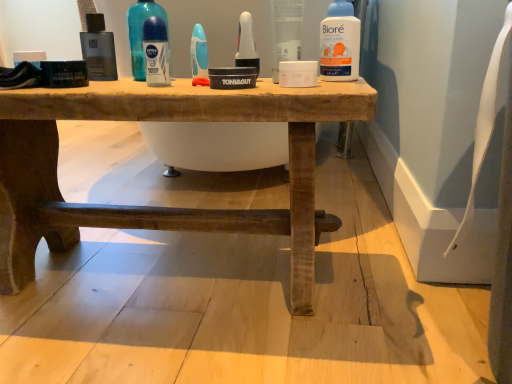
Question: Considering the relative positions of rustic wood table at center and white plastic biore at upper center, the second cleaning product positioned from the left, in the image provided, is rustic wood table at center to the left of white plastic biore at upper center, the second cleaning product positioned from the left, from the viewer's perspective?

Choices:
 (A) yes
 (B) no

Answer: (A)

Question: Does rustic wood table at center lie behind white plastic biore at upper center, acting as the 1th cleaning product starting from the right?

Choices:
 (A) no
 (B) yes

Answer: (A)

Question: From a real-world perspective, is rustic wood table at center beneath white plastic biore at upper center, the second cleaning product positioned from the left?

Choices:
 (A) yes
 (B) no

Answer: (A)

Question: Can you confirm if rustic wood table at center is taller than white plastic biore at upper center, the second cleaning product positioned from the left?

Choices:
 (A) no
 (B) yes

Answer: (B)

Question: Does rustic wood table at center have a greater width compared to white plastic biore at upper center, the 2th cleaning product viewed from the back?

Choices:
 (A) yes
 (B) no

Answer: (A)

Question: From the image's perspective, is rustic wood table at center positioned above or below white matte jar at center?

Choices:
 (A) below
 (B) above

Answer: (A)

Question: In the image, is rustic wood table at center on the left side or the right side of white matte jar at center?

Choices:
 (A) right
 (B) left

Answer: (B)

Question: Choose the correct answer: Is rustic wood table at center inside white matte jar at center or outside it?

Choices:
 (A) inside
 (B) outside

Answer: (B)

Question: Does point (6, 284) appear closer or farther from the camera than point (298, 18)?

Choices:
 (A) farther
 (B) closer

Answer: (A)

Question: Considering the positions of transparent plastic deodorant at center, the 2th mouthwash viewed from the left, and white matte jar at center in the image, is transparent plastic deodorant at center, the 2th mouthwash viewed from the left, taller or shorter than white matte jar at center?

Choices:
 (A) tall
 (B) short

Answer: (B)

Question: From the image's perspective, is transparent plastic deodorant at center, the 3th mouthwash positioned from the right, positioned above or below white matte jar at center?

Choices:
 (A) above
 (B) below

Answer: (B)

Question: From a real-world perspective, is transparent plastic deodorant at center, the 2th mouthwash viewed from the left, physically located above or below white matte jar at center?

Choices:
 (A) below
 (B) above

Answer: (A)

Question: Looking at their shapes, would you say transparent plastic deodorant at center, the 3th mouthwash positioned from the right, is wider or thinner than white matte jar at center?

Choices:
 (A) wide
 (B) thin

Answer: (B)

Question: Is point (138, 59) closer or farther from the camera than point (6, 243)?

Choices:
 (A) farther
 (B) closer

Answer: (A)

Question: Is blue glossy deodorant at upper center, arranged as the 2th cleaning product when viewed from the right, taller or shorter than rustic wood table at center?

Choices:
 (A) short
 (B) tall

Answer: (A)